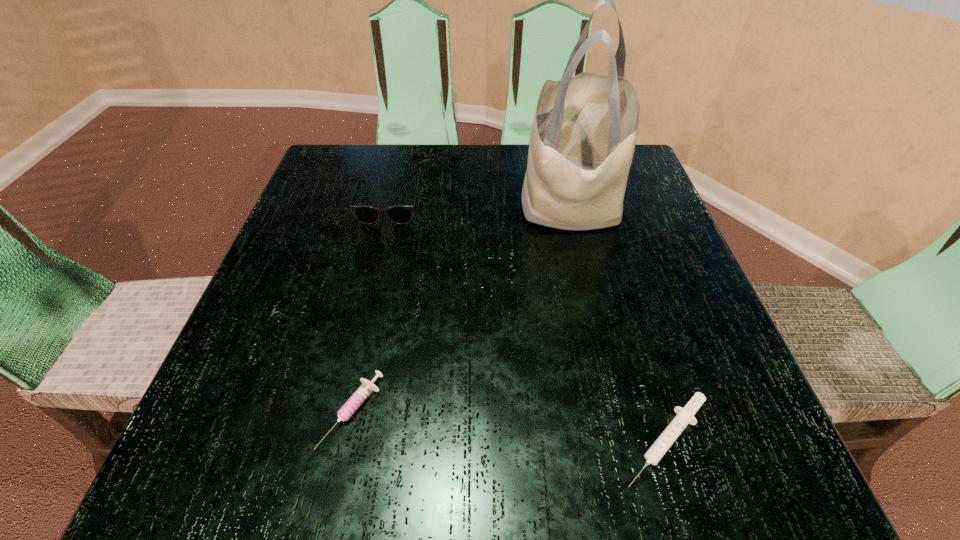
You are a GUI agent. You are given a task and a screenshot of the screen. Output one action in this format:
    pyautogui.click(x=<x>, y=<y>)
    Task: Click on the shopping bag
    
    Given the screenshot: What is the action you would take?
    pyautogui.click(x=583, y=136)

The height and width of the screenshot is (540, 960). I want to click on the second tallest object, so click(x=401, y=214).

This screenshot has height=540, width=960. In order to click on the left syringe in this screenshot , I will do `click(366, 388)`.

This screenshot has height=540, width=960. I want to click on the right syringe, so click(685, 416).

Identify the location of blank space located on the front of the tallest object. (612, 363).

Find the location of a particular element. Image resolution: width=960 pixels, height=540 pixels. free region located 0.290m at the front lenses of the third shortest object is located at coordinates (357, 342).

Locate an element on the screen. The image size is (960, 540). free location located on the right of the left syringe is located at coordinates (559, 412).

Where is `vacant position located 0.250m on the back of the right syringe`? vacant position located 0.250m on the back of the right syringe is located at coordinates (615, 272).

Identify the location of shopping bag that is at the far edge. The image size is (960, 540). (583, 136).

I want to click on sunglasses that is at the far edge, so click(x=401, y=214).